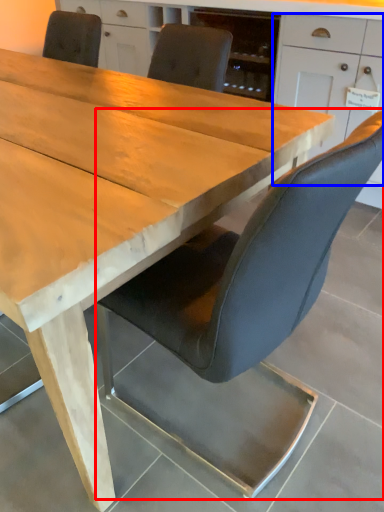
Question: Which object appears closest to the camera in this image, chair (highlighted by a red box) or cabinetry (highlighted by a blue box)?

Choices:
 (A) chair
 (B) cabinetry

Answer: (A)